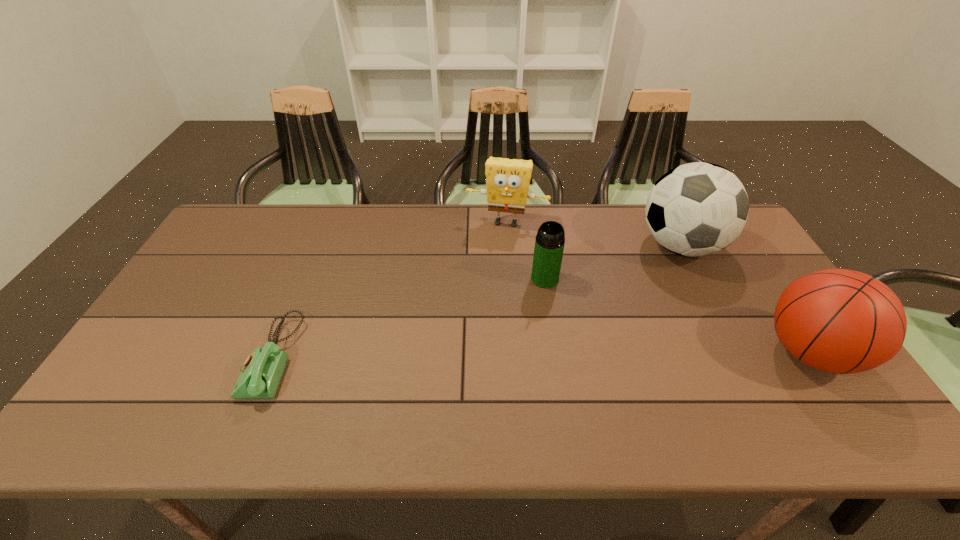
Identify the location of soccer ball that is positioned at the far edge. The width and height of the screenshot is (960, 540). (696, 209).

This screenshot has width=960, height=540. I want to click on telephone that is at the near edge, so click(x=262, y=370).

Identify the location of basketball that is at the near edge. This screenshot has height=540, width=960. (840, 321).

This screenshot has width=960, height=540. What are the coordinates of `basketball at the right edge` in the screenshot? It's located at (840, 321).

Find the location of a particular element. Image resolution: width=960 pixels, height=540 pixels. soccer ball positioned at the right edge is located at coordinates (696, 209).

Locate an element on the screen. Image resolution: width=960 pixels, height=540 pixels. object that is at the far right corner is located at coordinates (696, 209).

Where is `object situated at the near right corner`? object situated at the near right corner is located at coordinates click(840, 321).

This screenshot has height=540, width=960. What are the coordinates of `free space at the far edge of the desktop` in the screenshot? It's located at (631, 243).

The width and height of the screenshot is (960, 540). In the image, there is a desktop. What are the coordinates of `vacant space at the near edge` in the screenshot? It's located at (214, 381).

The height and width of the screenshot is (540, 960). Identify the location of vacant space at the left edge of the desktop. (248, 262).